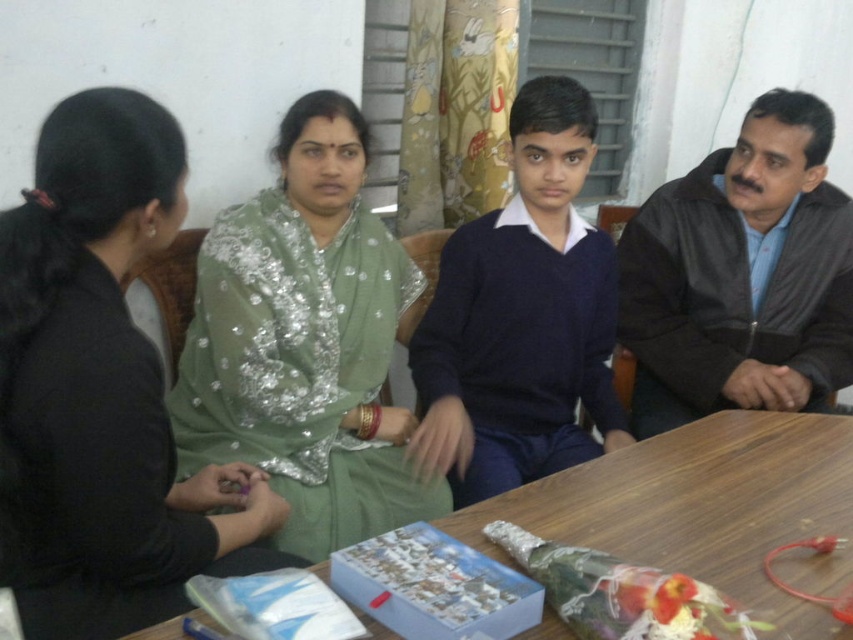
Question: Based on their relative distances, which object is nearer to the dark brown leather jacket at right?

Choices:
 (A) matte green saree at center
 (B) green sequined shawl at center

Answer: (B)

Question: Which object appears closest to the camera in this image?

Choices:
 (A) green sequined shawl at center
 (B) dark brown leather jacket at right
 (C) matte green saree at center
 (D) dark blue sweater at center

Answer: (C)

Question: Which point is closer to the camera taking this photo?

Choices:
 (A) (30, 516)
 (B) (728, 349)
 (C) (625, 490)
 (D) (207, 276)

Answer: (A)

Question: Is dark brown leather jacket at right to the right of dark blue sweater at center from the viewer's perspective?

Choices:
 (A) no
 (B) yes

Answer: (B)

Question: Is green sequined shawl at center further to the viewer compared to dark brown leather jacket at right?

Choices:
 (A) no
 (B) yes

Answer: (A)

Question: Is dark brown leather jacket at right above dark blue sweater at center?

Choices:
 (A) no
 (B) yes

Answer: (B)